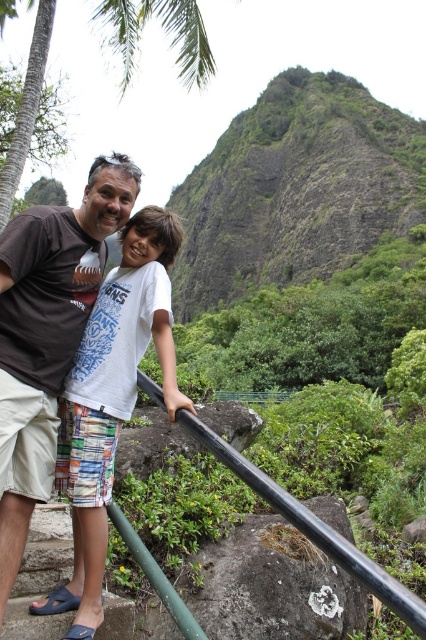
Question: Based on their relative distances, which object is farther from the green rocky mountain at upper center?

Choices:
 (A) green leafy palm tree at upper left
 (B) brown cotton t-shirt at center

Answer: (B)

Question: Does brown cotton t-shirt at center appear under green leafy palm tree at upper left?

Choices:
 (A) yes
 (B) no

Answer: (A)

Question: Does brown cotton t-shirt at center come in front of green leafy palm tree at upper left?

Choices:
 (A) yes
 (B) no

Answer: (A)

Question: Which of the following is the farthest from the observer?

Choices:
 (A) green leafy palm tree at upper left
 (B) green rocky mountain at upper center
 (C) brown cotton t-shirt at center

Answer: (B)

Question: Which of the following is the farthest from the observer?

Choices:
 (A) (31, 500)
 (B) (17, 141)

Answer: (B)

Question: Does brown cotton t-shirt at center appear on the right side of green leafy palm tree at upper left?

Choices:
 (A) no
 (B) yes

Answer: (B)